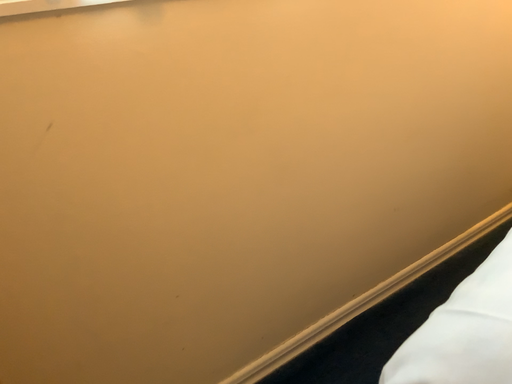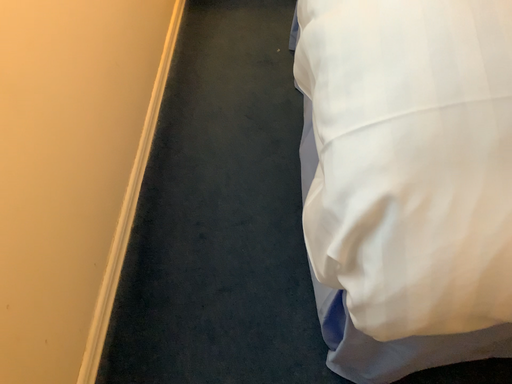
Question: Which way did the camera rotate in the video?

Choices:
 (A) rotated right
 (B) rotated left

Answer: (A)